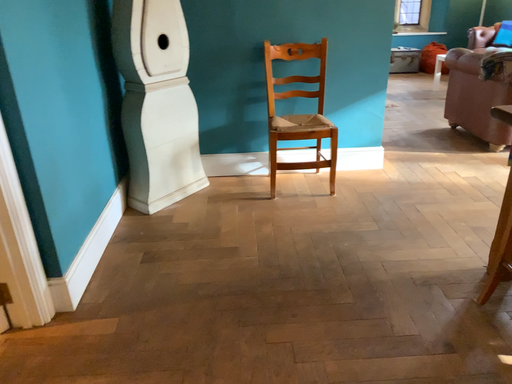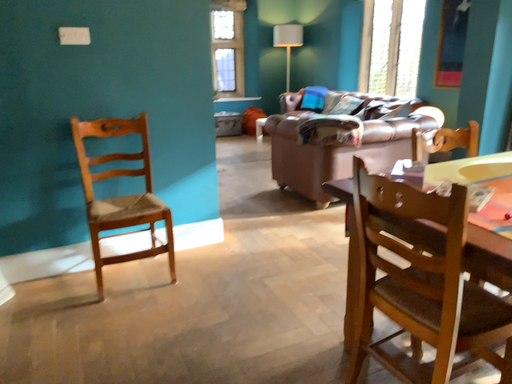
Question: Which way did the camera rotate in the video?

Choices:
 (A) rotated right
 (B) rotated left

Answer: (A)